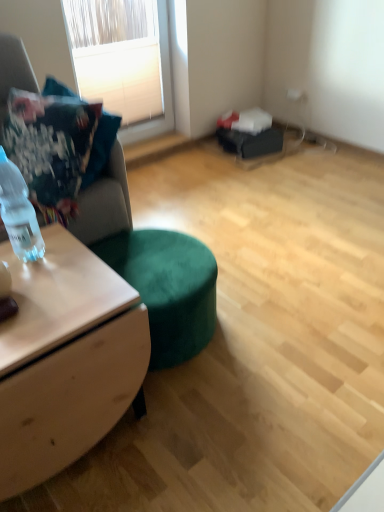
Question: Is white textured blinds at upper left smaller than suede fabric couch at left?

Choices:
 (A) yes
 (B) no

Answer: (A)

Question: Is suede fabric couch at left at the back of white textured blinds at upper left?

Choices:
 (A) no
 (B) yes

Answer: (A)

Question: From a real-world perspective, is white textured blinds at upper left on suede fabric couch at left?

Choices:
 (A) yes
 (B) no

Answer: (A)

Question: Is the surface of white textured blinds at upper left in direct contact with suede fabric couch at left?

Choices:
 (A) no
 (B) yes

Answer: (A)

Question: Are white textured blinds at upper left and suede fabric couch at left far apart?

Choices:
 (A) yes
 (B) no

Answer: (A)

Question: Based on their sizes in the image, would you say clear plastic bottle at left is bigger or smaller than white textured blinds at upper left?

Choices:
 (A) big
 (B) small

Answer: (B)

Question: In terms of height, does clear plastic bottle at left look taller or shorter compared to white textured blinds at upper left?

Choices:
 (A) short
 (B) tall

Answer: (A)

Question: Would you say clear plastic bottle at left is to the left or to the right of white textured blinds at upper left in the picture?

Choices:
 (A) left
 (B) right

Answer: (A)

Question: Relative to white textured blinds at upper left, is clear plastic bottle at left in front or behind?

Choices:
 (A) front
 (B) behind

Answer: (A)

Question: In terms of height, does suede fabric couch at left look taller or shorter compared to wooden desk at left?

Choices:
 (A) tall
 (B) short

Answer: (A)

Question: Is suede fabric couch at left wider or thinner than wooden desk at left?

Choices:
 (A) thin
 (B) wide

Answer: (B)

Question: Is point (104, 212) positioned closer to the camera than point (79, 364)?

Choices:
 (A) farther
 (B) closer

Answer: (A)

Question: Is suede fabric couch at left inside or outside of wooden desk at left?

Choices:
 (A) outside
 (B) inside

Answer: (A)

Question: Is point (102, 348) closer or farther from the camera than point (41, 160)?

Choices:
 (A) closer
 (B) farther

Answer: (A)

Question: From the image's perspective, is wooden desk at left positioned above or below velvet cushion at left?

Choices:
 (A) above
 (B) below

Answer: (B)